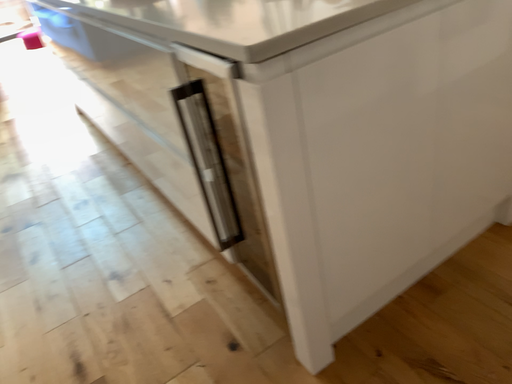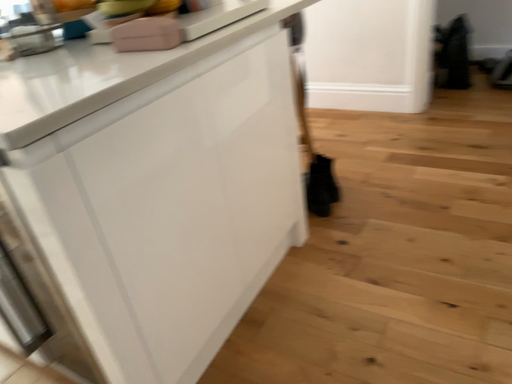
Question: Which way did the camera rotate in the video?

Choices:
 (A) rotated downward
 (B) rotated upward

Answer: (B)